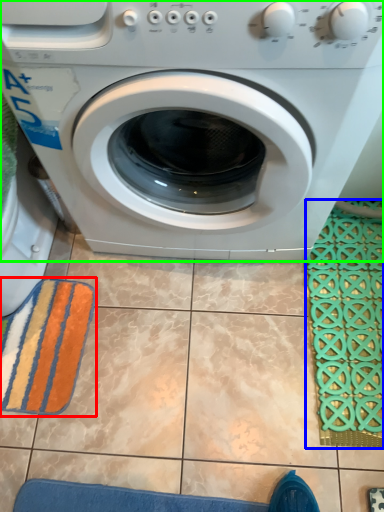
Question: Estimate the real-world distances between objects in this image. Which object is closer to bath towel (highlighted by a red box), bath mat (highlighted by a blue box) or washing machine (highlighted by a green box)?

Choices:
 (A) bath mat
 (B) washing machine

Answer: (B)